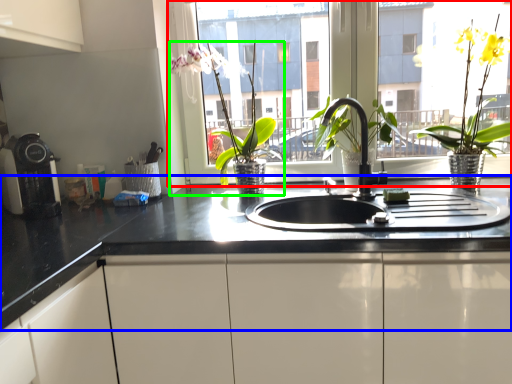
Question: Considering the real-world distances, which object is farthest from window (highlighted by a red box)? countertop (highlighted by a blue box) or houseplant (highlighted by a green box)?

Choices:
 (A) countertop
 (B) houseplant

Answer: (A)